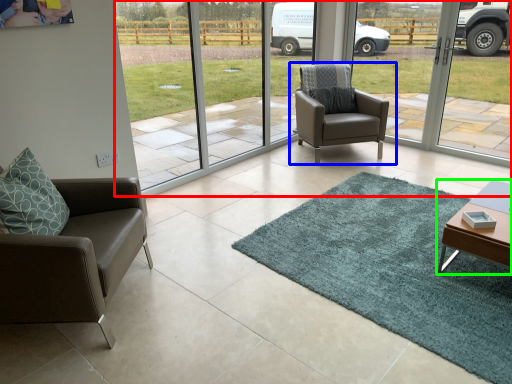
Question: Which object is positioned farthest from window screen (highlighted by a red box)? Select from chair (highlighted by a blue box) and table (highlighted by a green box).

Choices:
 (A) chair
 (B) table

Answer: (B)